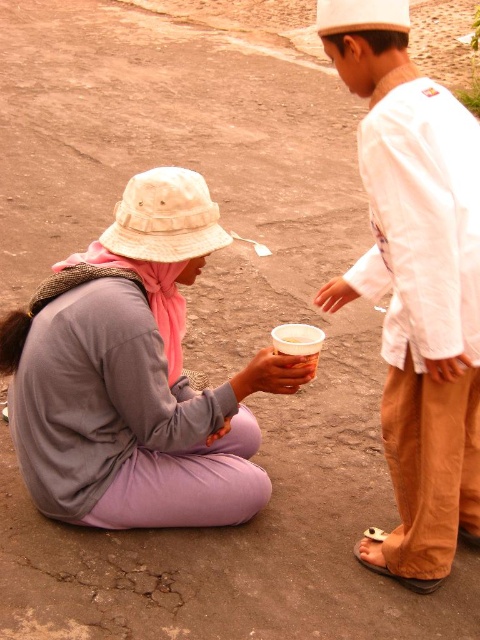
Question: Which of the following is the farthest from the observer?

Choices:
 (A) white plastic cup at center
 (B) purple fabric at lower left
 (C) white cotton shirt at right

Answer: (A)

Question: From the image, what is the correct spatial relationship of white cotton shirt at right in relation to white plastic cup at center?

Choices:
 (A) left
 (B) right

Answer: (B)

Question: Can you confirm if purple fabric at lower left is wider than white plastic cup at center?

Choices:
 (A) yes
 (B) no

Answer: (A)

Question: Can you confirm if purple fabric at lower left is thinner than white plastic cup at center?

Choices:
 (A) no
 (B) yes

Answer: (A)

Question: Which point is closer to the camera taking this photo?

Choices:
 (A) coord(447,548)
 (B) coord(312,369)
 (C) coord(46,392)

Answer: (B)

Question: Which of these objects is positioned farthest from the purple fabric at lower left?

Choices:
 (A) white cotton shirt at right
 (B) white plastic cup at center

Answer: (A)